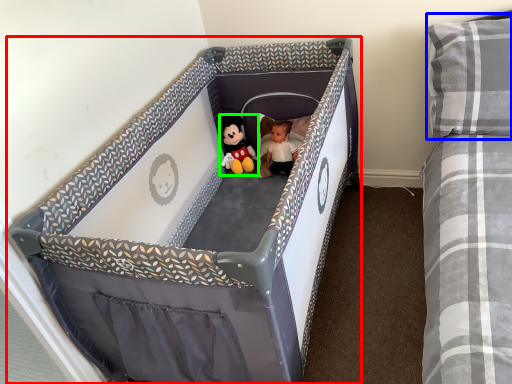
Question: Estimate the real-world distances between objects in this image. Which object is farther from infant bed (highlighted by a red box), pillow (highlighted by a blue box) or toy (highlighted by a green box)?

Choices:
 (A) pillow
 (B) toy

Answer: (A)